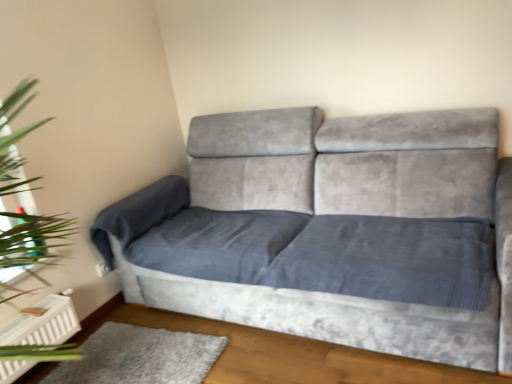
Question: Considering the positions of green leafy plant at left and velvet grey couch at center in the image, is green leafy plant at left wider or thinner than velvet grey couch at center?

Choices:
 (A) wide
 (B) thin

Answer: (B)

Question: In the image, is green leafy plant at left on the left side or the right side of velvet grey couch at center?

Choices:
 (A) right
 (B) left

Answer: (B)

Question: Based on their relative distances, which object is nearer to the teal glass at left?

Choices:
 (A) green leafy plant at left
 (B) gray plush rug at lower left
 (C) velvet grey couch at center

Answer: (A)

Question: Which of these objects is positioned closest to the velvet grey couch at center?

Choices:
 (A) green leafy plant at left
 (B) teal glass at left
 (C) gray plush rug at lower left

Answer: (C)